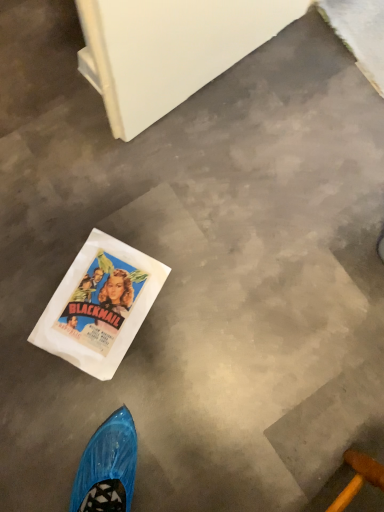
This screenshot has height=512, width=384. I want to click on vacant space positioned to the left of white paper comic book at lower left, so click(x=18, y=272).